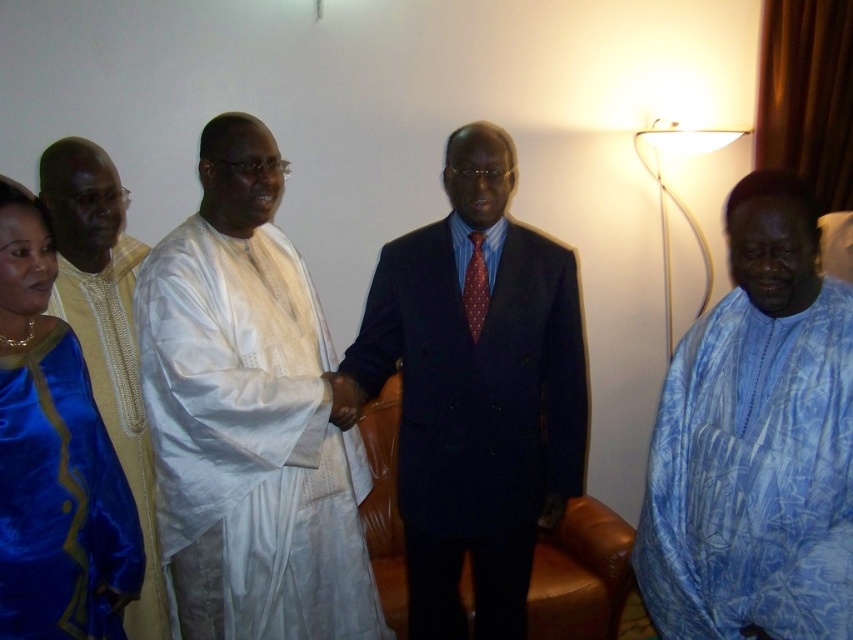
Question: Which of the following is the closest to the observer?

Choices:
 (A) blue printed fabric shirt at right
 (B) satin blue dress at left
 (C) dark blue suit at center
 (D) white cloth at center

Answer: (A)

Question: Can you confirm if white cloth at center is bigger than satin blue dress at left?

Choices:
 (A) yes
 (B) no

Answer: (A)

Question: Does dark blue suit at center lie behind satin blue dress at left?

Choices:
 (A) yes
 (B) no

Answer: (A)

Question: Which object is the closest to the satin blue dress at left?

Choices:
 (A) dark blue suit at center
 (B) white cloth at center

Answer: (B)

Question: Is white cloth at center to the left of blue printed fabric shirt at right from the viewer's perspective?

Choices:
 (A) yes
 (B) no

Answer: (A)

Question: Which of these objects is positioned farthest from the satin blue dress at left?

Choices:
 (A) blue printed fabric shirt at right
 (B) white cloth at center
 (C) dark blue suit at center

Answer: (A)